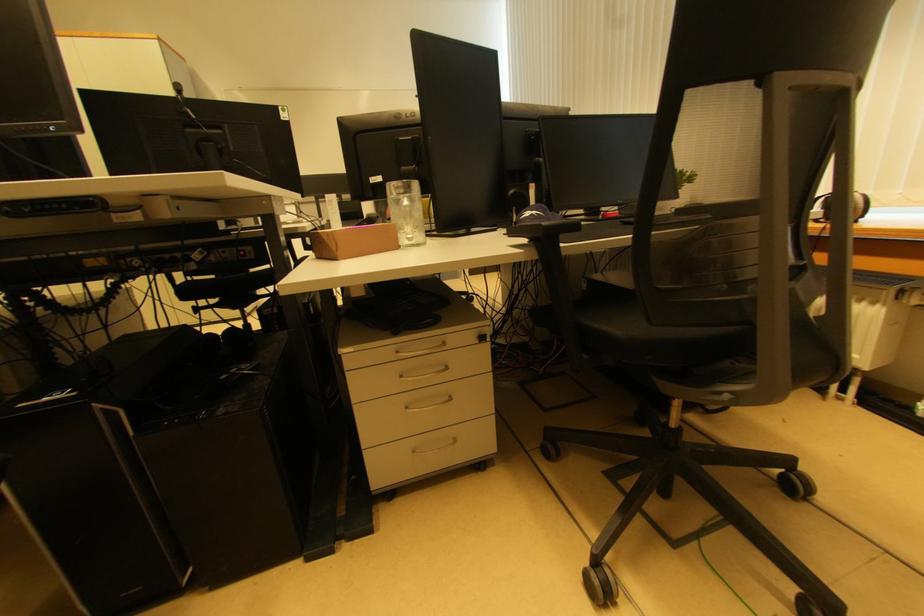
This screenshot has width=924, height=616. I want to click on small cardboard box, so click(x=354, y=241).